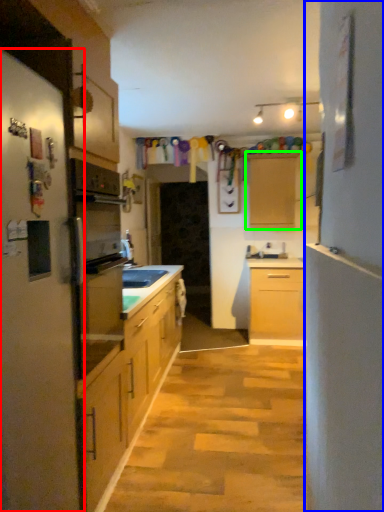
Question: Which object is the farthest from fridge (highlighted by a red box)? Choose among these: side (highlighted by a blue box) or cabinetry (highlighted by a green box).

Choices:
 (A) side
 (B) cabinetry

Answer: (B)